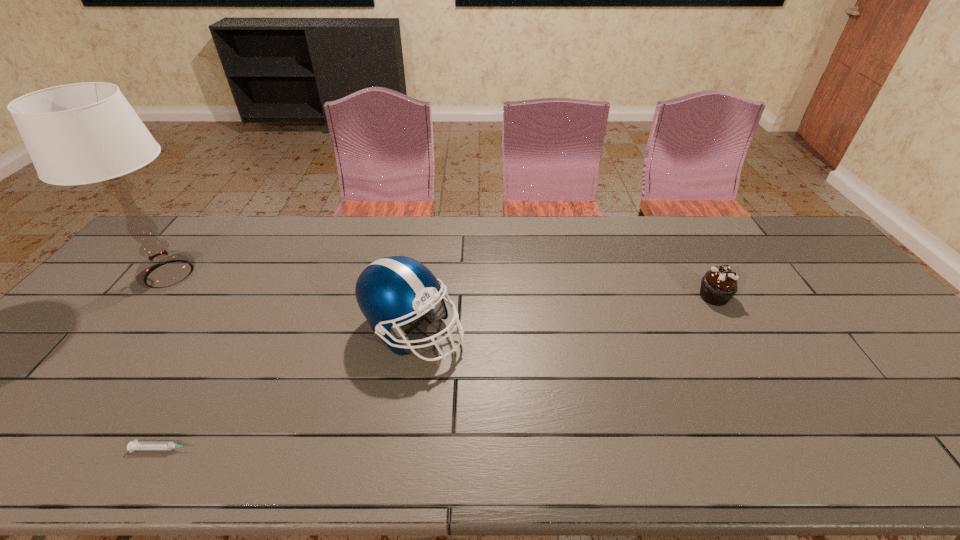
Where is `the tallest object`? The image size is (960, 540). the tallest object is located at coordinates (81, 133).

You are a GUI agent. You are given a task and a screenshot of the screen. Output one action in this format:
    pyautogui.click(x=<x>, y=<y>)
    Task: Click on the table lamp
    The image size is (960, 540).
    Given the screenshot: What is the action you would take?
    pyautogui.click(x=81, y=133)

Find the location of `the third object from left to right`. the third object from left to right is located at coordinates (390, 290).

Locate an element on the screen. Image resolution: width=960 pixels, height=540 pixels. football helmet is located at coordinates (390, 290).

Identify the location of the rightmost object. (719, 284).

Identify the location of the third tallest object. This screenshot has width=960, height=540. (719, 284).

What are the coordinates of `syringe` in the screenshot? It's located at (135, 445).

At what (x,y) coordinates should I click in order to perform the action: click on the nearest object. Please return your answer as a coordinate pair (x, y). The image size is (960, 540). Looking at the image, I should click on (135, 445).

You are a GUI agent. You are given a task and a screenshot of the screen. Output one action in this format:
    pyautogui.click(x=<x>, y=<y>)
    Task: Click on the free space located 0.380m on the front-facing side of the tallest object
    
    Given the screenshot: What is the action you would take?
    pyautogui.click(x=336, y=274)

In order to click on free spot located at the front of the second tallest object with the faceguard in this screenshot , I will do `click(528, 331)`.